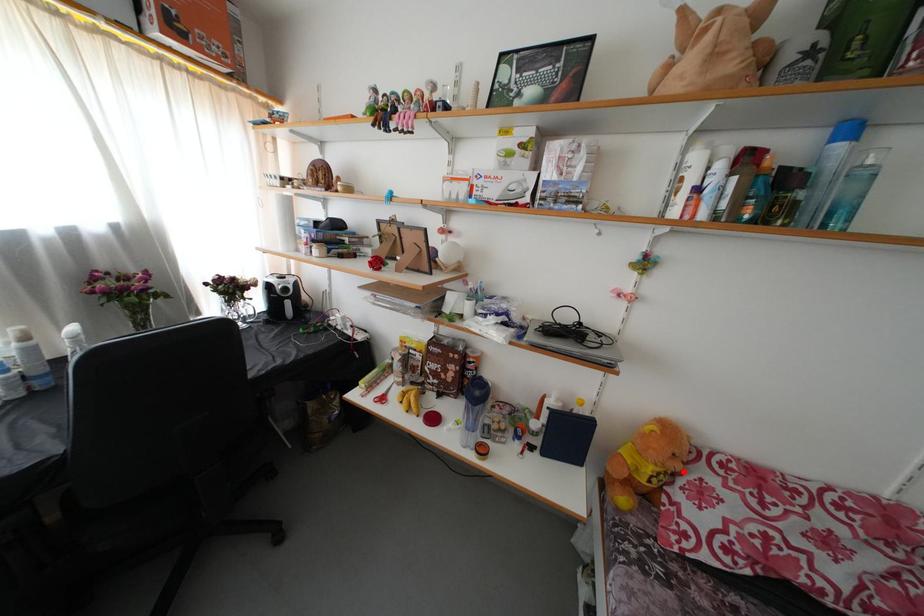
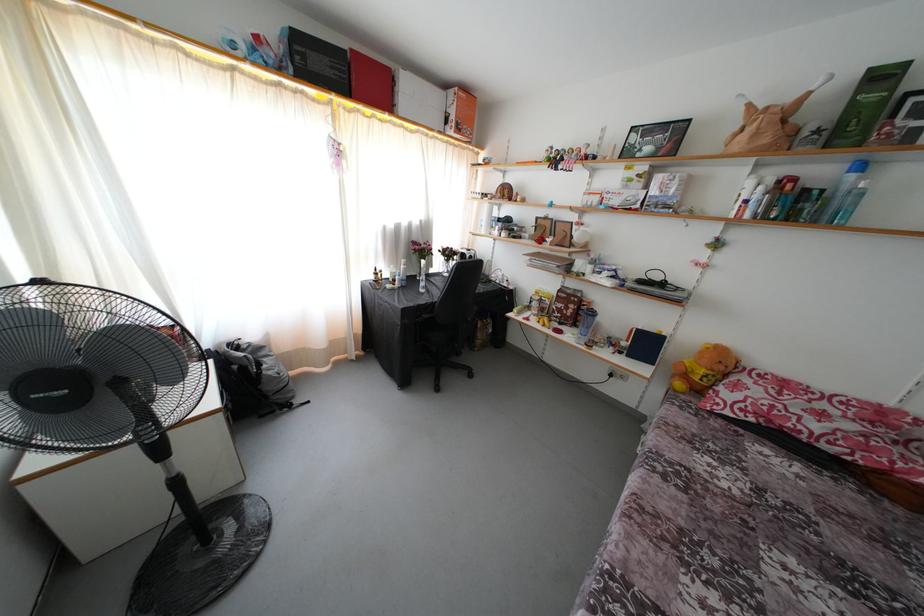
Where in the second image is the point corresponding to the highlighted location from the first image?

(726, 373)